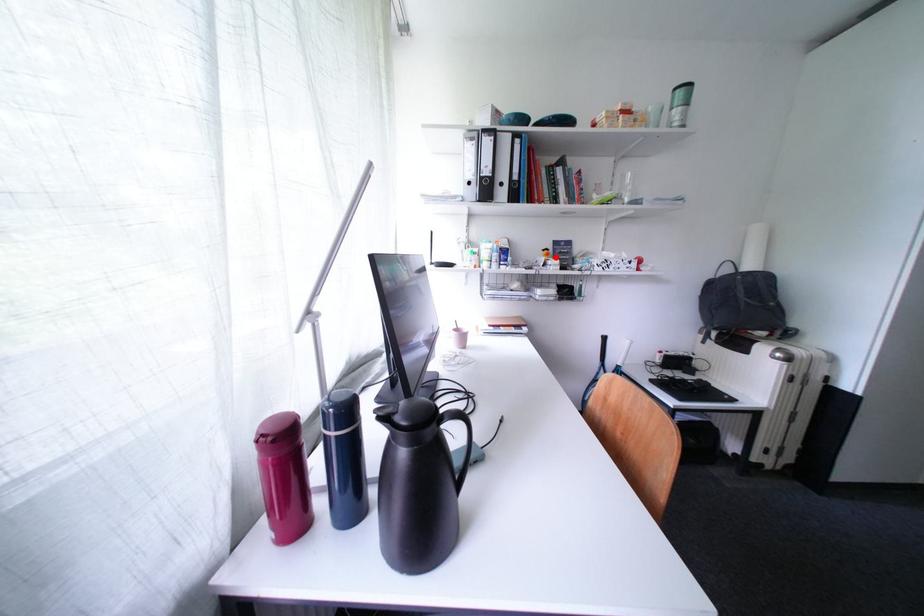
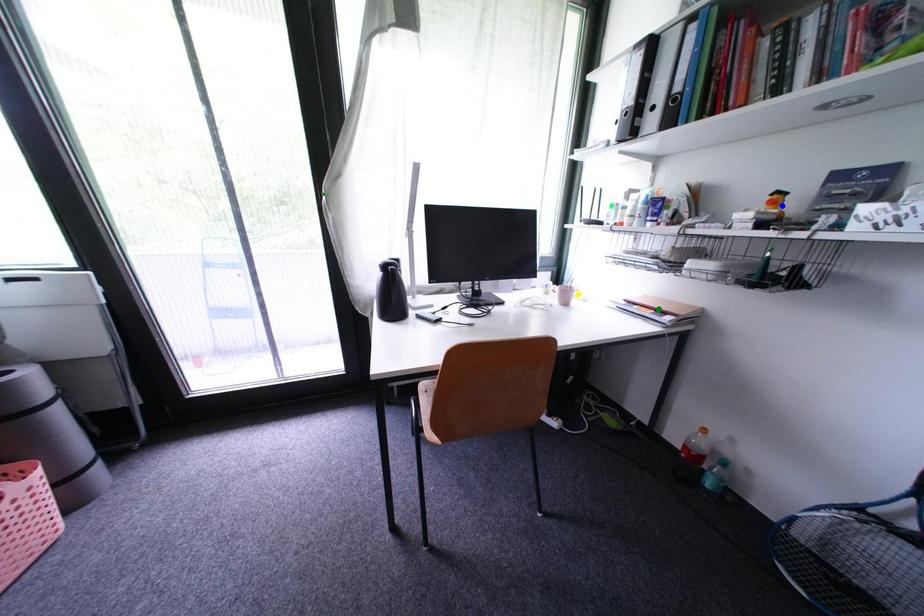
Question: I am providing you with two images of the same scene from different viewpoints. A red point is marked on the first image. You are given multiple points on the second image. Which mark in image 2 goes with the point in image 1?

Choices:
 (A) green point
 (B) blue point
 (C) yellow point

Answer: (B)